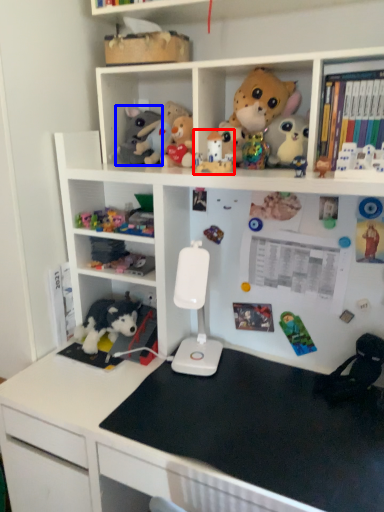
Question: Which of the following is the farthest to the observer, toy (highlighted by a red box) or toy (highlighted by a blue box)?

Choices:
 (A) toy
 (B) toy

Answer: (B)